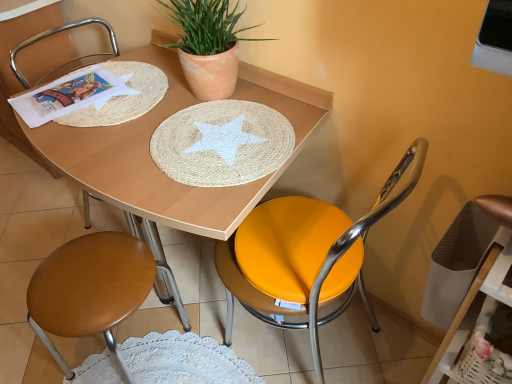
I want to click on free space on the front side of matte terracotta pot at upper center, so click(x=205, y=138).